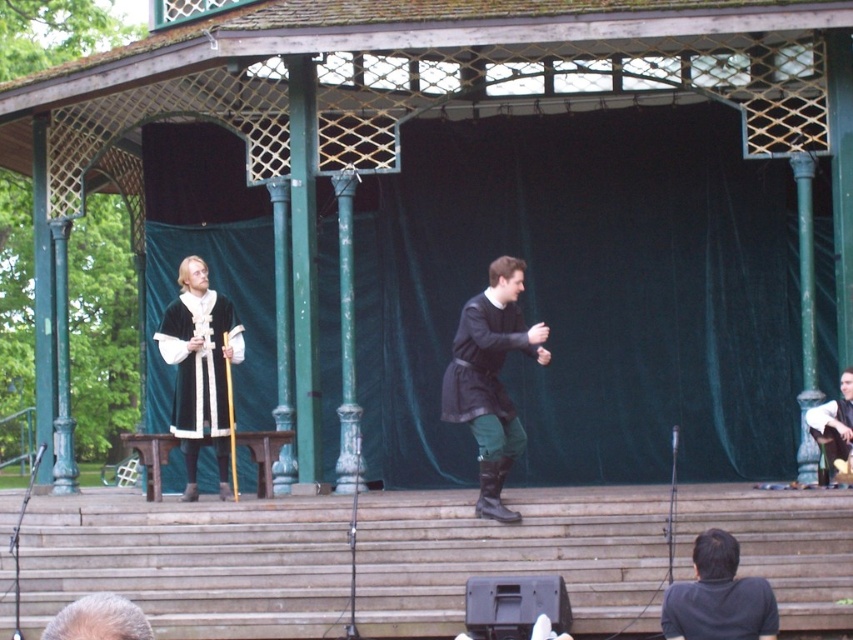
You are an audience member sitting in the front row of the gazebo stage. You notice the velvet black robe at center and the smooth brown leather jacket at right. Which clothing item is closer to the stage backdrop?

The smooth brown leather jacket at right is behind the velvet black robe at center, so it is closer to the stage backdrop.

From the picture: You are an event planner setting up a photo shoot in the gazebo. You need to position a tall camera stand between the velvet black robe at center and the smooth brown leather jacket at right. Which side should you place the camera stand closer to ensure it doesn

The velvet black robe at center is shorter than the smooth brown leather jacket at right. To accommodate the taller smooth brown leather jacket at right, the camera stand should be placed closer to the velvet black robe at center to avoid blocking the view of the taller jacket.